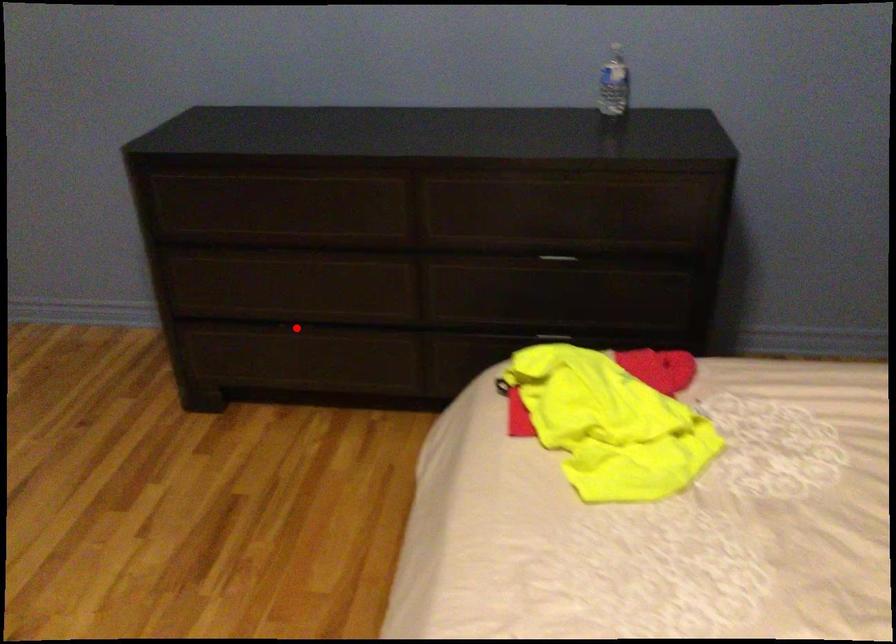
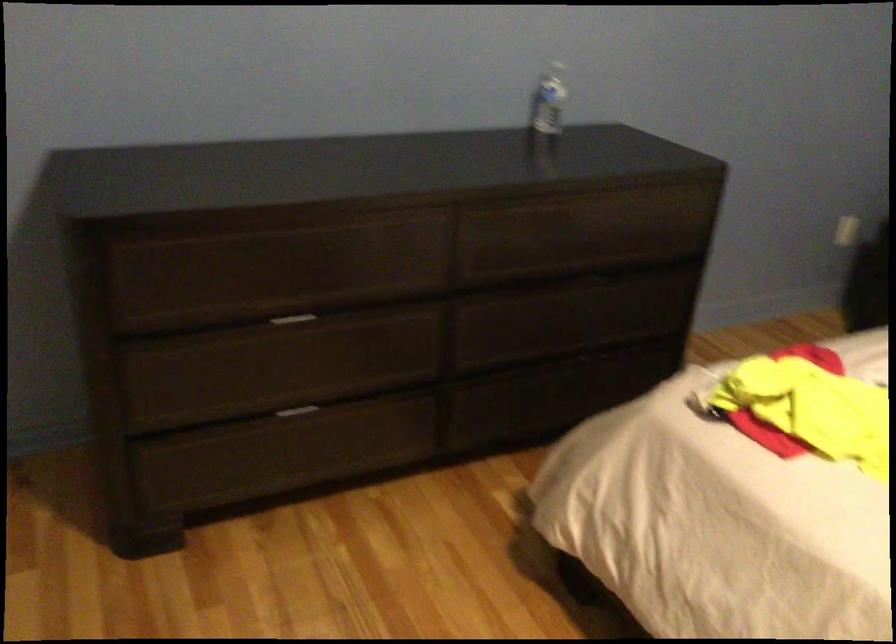
Question: I am providing you with two images of the same scene from different viewpoints. A red point is shown in image1. For the corresponding object point in image2, is it positioned nearer or farther from the camera?

Choices:
 (A) Nearer
 (B) Farther

Answer: (A)